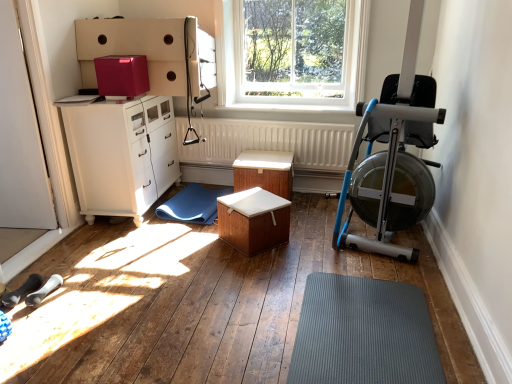
Locate an element on the screen. The height and width of the screenshot is (384, 512). free space above white textured radiator at center (from a real-world perspective) is located at coordinates (257, 119).